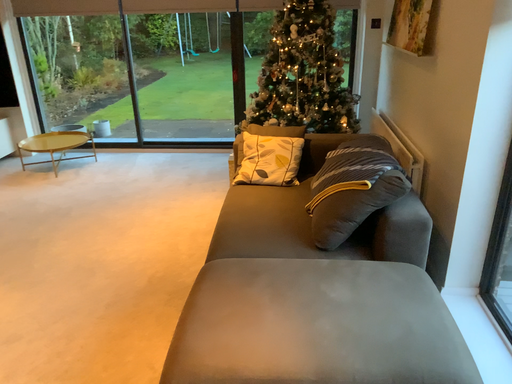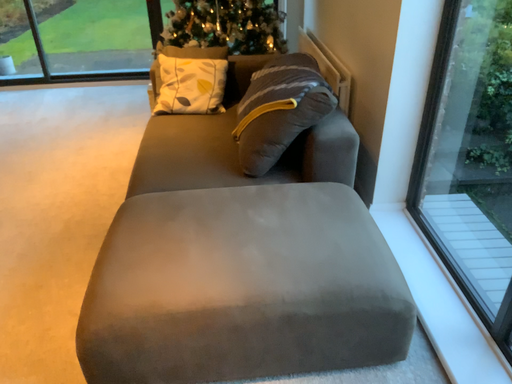
Question: How did the camera likely rotate when shooting the video?

Choices:
 (A) rotated left
 (B) rotated right

Answer: (B)